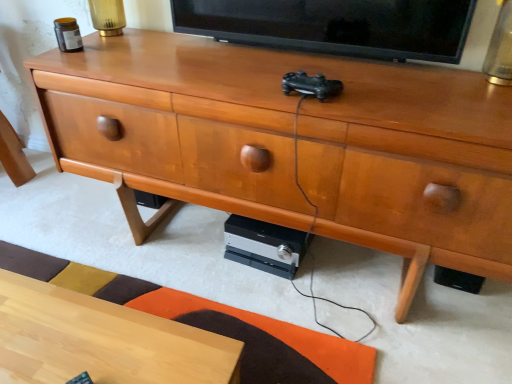
Where is `free area below black glossy tv at upper center (from a real-world perspective)`? This screenshot has height=384, width=512. free area below black glossy tv at upper center (from a real-world perspective) is located at coordinates (306, 48).